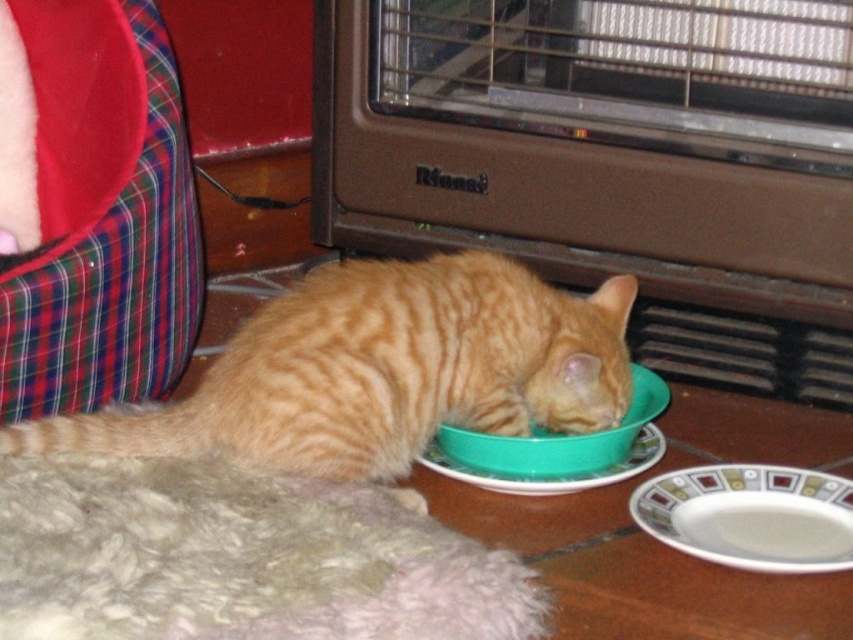
You are a robotic pet feeder that needs to place a new bowl between the white glossy plate at lower right and the green plastic bowl at lower center. The new bowl has a diameter of 6 inches. Can it fit in the space between them?

The distance between the white glossy plate at lower right and the green plastic bowl at lower center is 5.77 inches. Since the new bowl has a diameter of 6 inches, it cannot fit in the space between them as it requires more space than available.